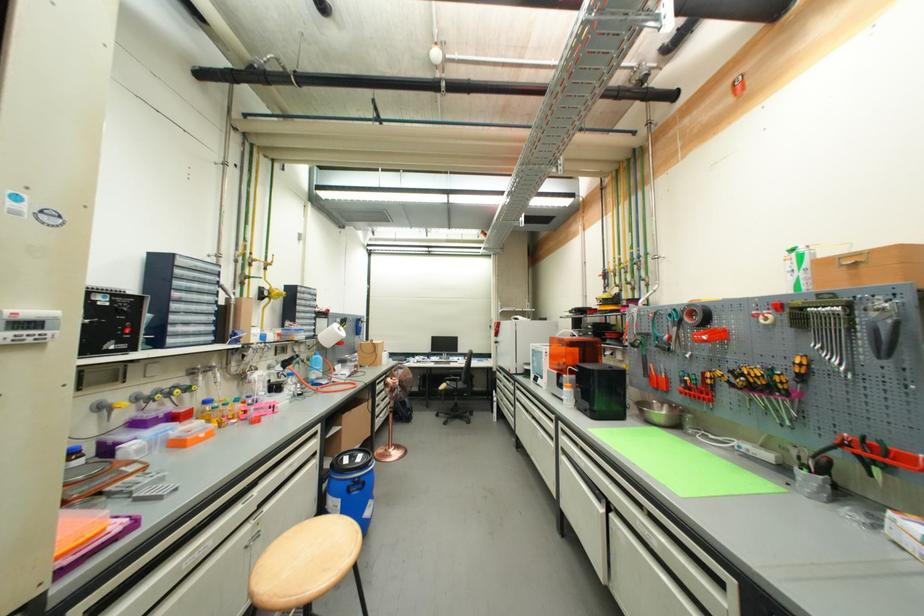
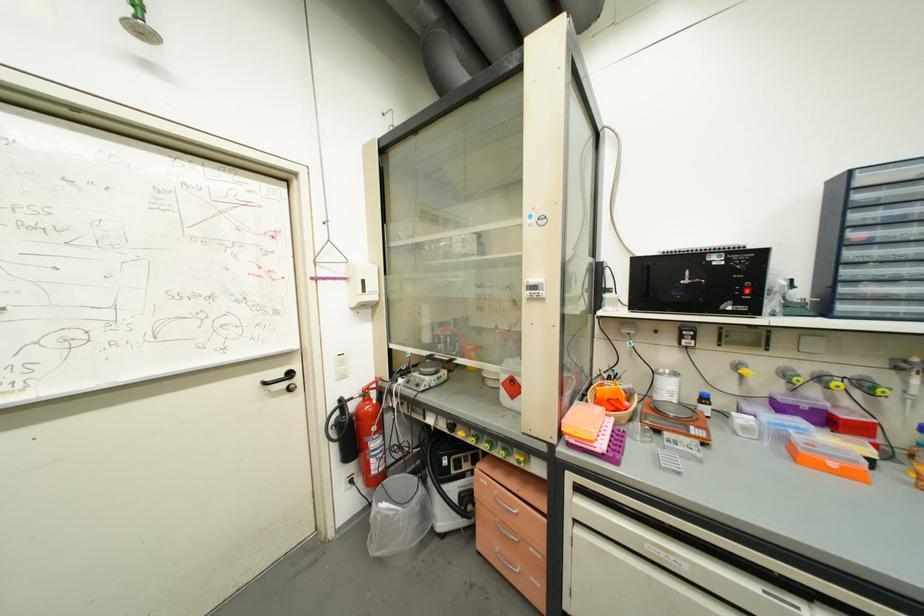
Where in the second image is the point corresponding to (x=47, y=219) from the first image?

(544, 224)